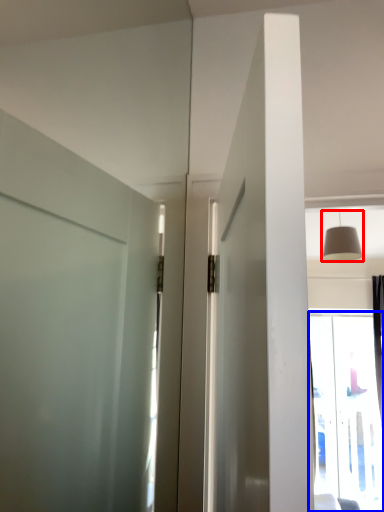
Question: Which of the following is the closest to the observer, light fixture (highlighted by a red box) or window (highlighted by a blue box)?

Choices:
 (A) light fixture
 (B) window

Answer: (A)